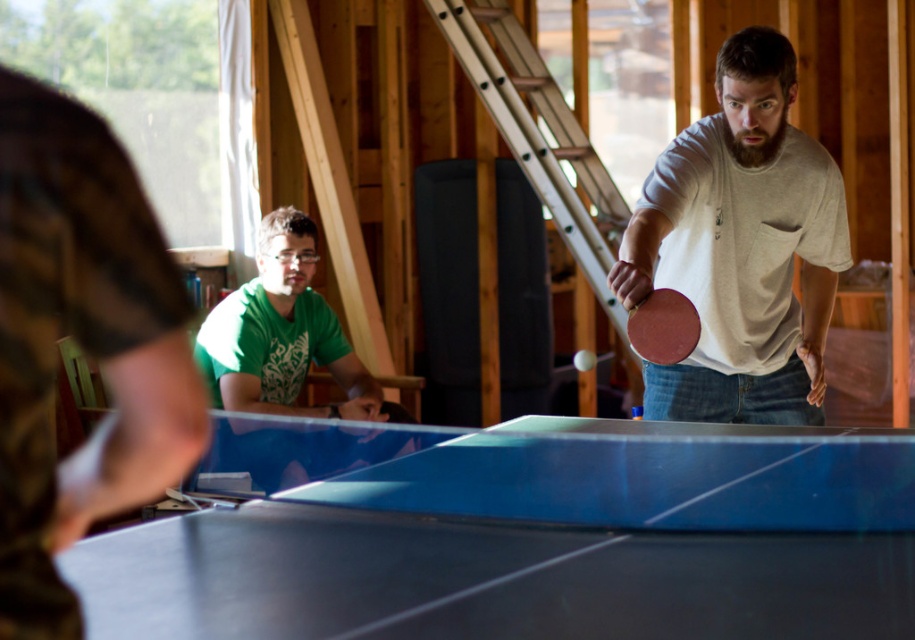
Is blue glossy table tennis table at center above rubber paddle at center?

No, blue glossy table tennis table at center is not above rubber paddle at center.

Between point (910, 502) and point (641, 349), which one is positioned in front?

Positioned in front is point (910, 502).

Identify the location of blue glossy table tennis table at center. (644, 477).

Measure the distance between point (778, 157) and camera.

Point (778, 157) and camera are 9.80 feet apart from each other.

Is matte gray t-shirt at right taller than green matte shirt at left?

Correct, matte gray t-shirt at right is much taller as green matte shirt at left.

Image resolution: width=915 pixels, height=640 pixels. I want to click on matte gray t-shirt at right, so click(741, 248).

Who is higher up, blue glossy ping pong table at center or matte gray t-shirt at right?

Positioned higher is matte gray t-shirt at right.

Can you confirm if blue glossy ping pong table at center is shorter than matte gray t-shirt at right?

Yes.

Describe the element at coordinates (521, 534) in the screenshot. The height and width of the screenshot is (640, 915). I see `blue glossy ping pong table at center` at that location.

Where is `blue glossy ping pong table at center`? The width and height of the screenshot is (915, 640). blue glossy ping pong table at center is located at coordinates (521, 534).